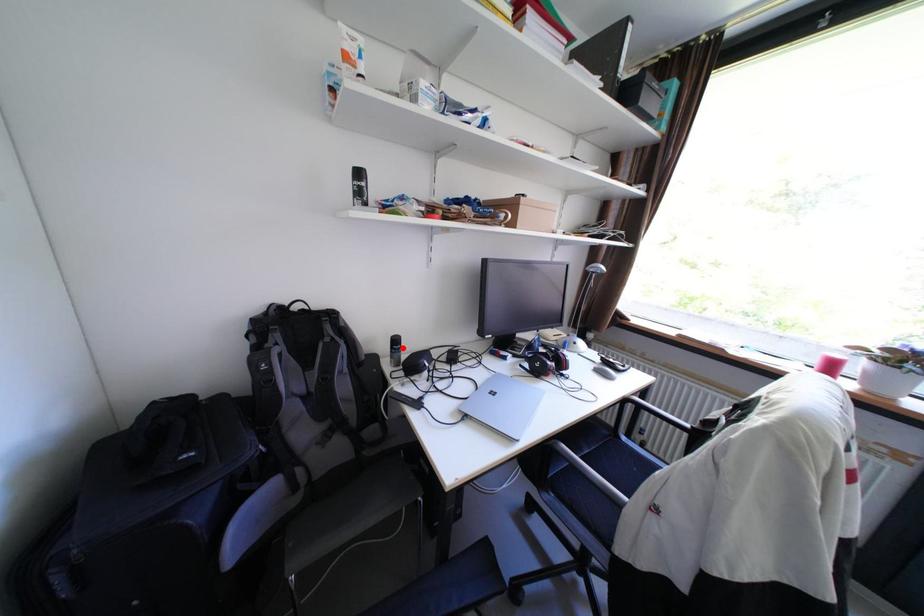
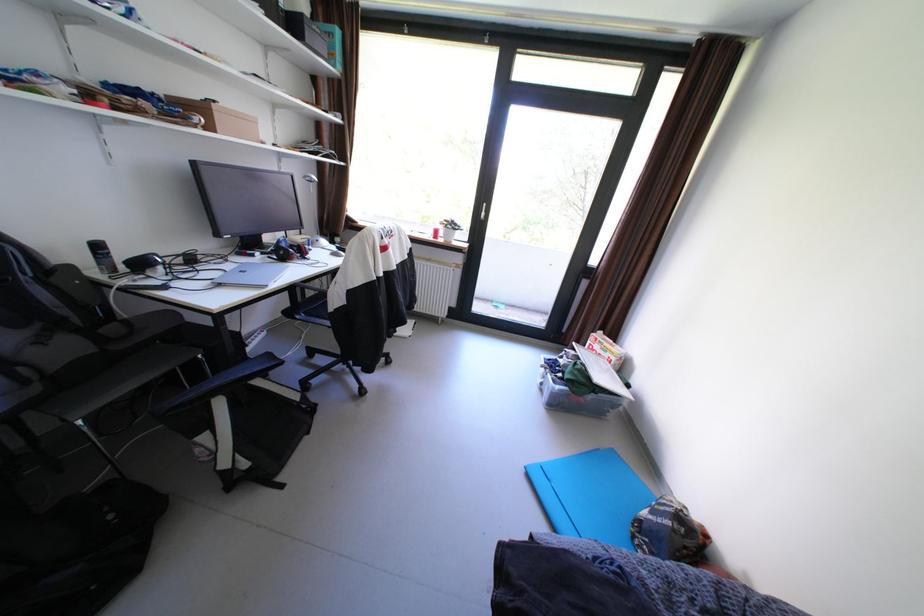
Where in the second image is the point corresponding to the highlighted location from the first image?

(106, 254)